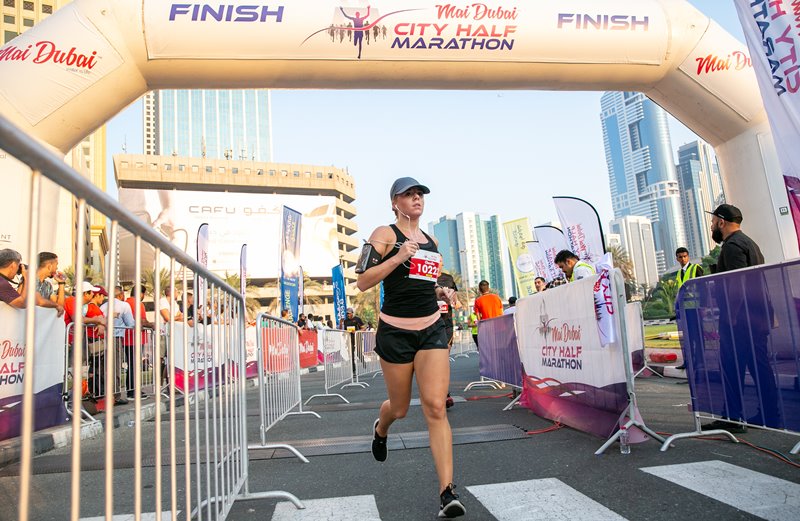
In order to click on white arch in this screenshot , I will do `click(558, 44)`.